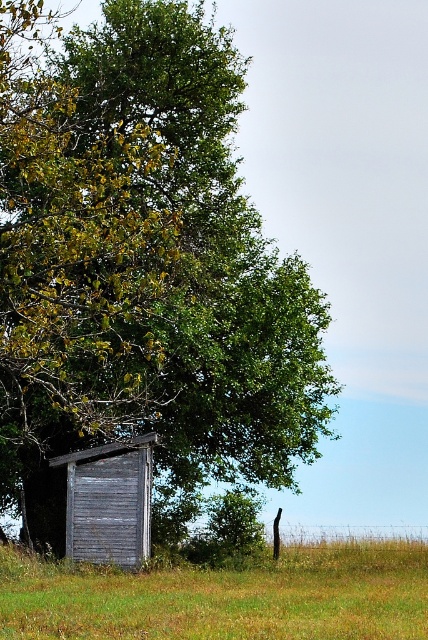
Which is more to the left, green leafy tree at upper left or green grass at lower center?

green leafy tree at upper left is more to the left.

In the scene shown: Does green leafy tree at upper left have a lesser width compared to green grass at lower center?

Yes, green leafy tree at upper left is thinner than green grass at lower center.

Consider the image. Who is more forward, (24, 490) or (44, 614)?

Point (44, 614) is in front.

This screenshot has width=428, height=640. I want to click on green leafy tree at upper left, so click(x=145, y=260).

Does point (109, 324) come in front of point (142, 484)?

Yes, point (109, 324) is closer to viewer.

Find the location of a particular element. green leafy tree at upper left is located at coordinates (145, 260).

Between point (404, 602) and point (146, 465), which one is positioned in front?

Positioned in front is point (404, 602).

Can you confirm if green grass at lower center is taller than weathered wood shed at lower left?

No.

Find the location of a particular element. This screenshot has width=428, height=640. green grass at lower center is located at coordinates (222, 596).

The width and height of the screenshot is (428, 640). Find the location of `green grass at lower center`. green grass at lower center is located at coordinates (222, 596).